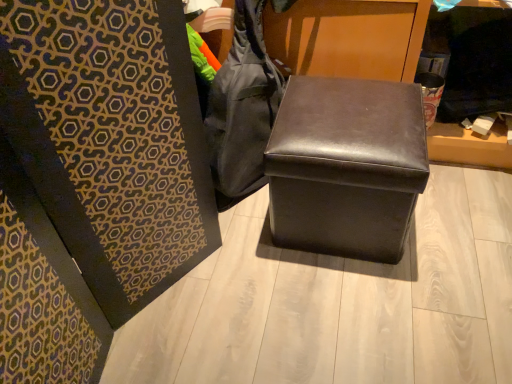
Find the location of a particular element. The height and width of the screenshot is (384, 512). vacant area on top of matte brown ottoman at center (from a real-world perspective) is located at coordinates (341, 120).